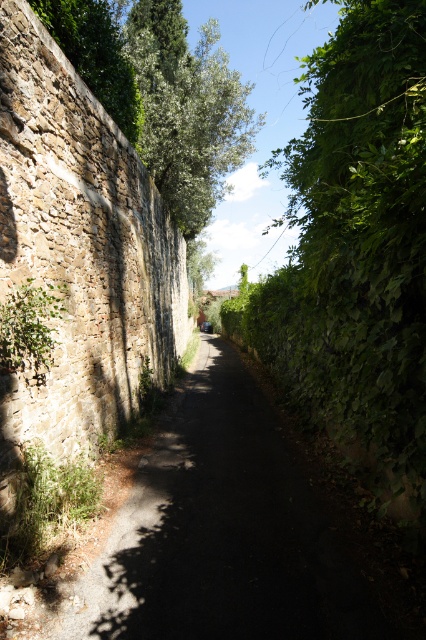
Does dark asphalt path at center appear over dark gray metallic car at center?

No, dark asphalt path at center is not above dark gray metallic car at center.

Who is lower down, dark asphalt path at center or dark gray metallic car at center?

dark asphalt path at center is lower down.

The width and height of the screenshot is (426, 640). In order to click on dark asphalt path at center in this screenshot , I will do pos(227,534).

Between dark asphalt path at center and green rough stone wall at upper left, which one is positioned lower?

dark asphalt path at center is below.

At what (x,y) coordinates should I click in order to perform the action: click on dark asphalt path at center. Please return your answer as a coordinate pair (x, y). This screenshot has height=640, width=426. Looking at the image, I should click on (227, 534).

You are a GUI agent. You are given a task and a screenshot of the screen. Output one action in this format:
    pyautogui.click(x=<x>, y=<y>)
    Task: Click on the dark asphalt path at center
    
    Given the screenshot: What is the action you would take?
    pyautogui.click(x=227, y=534)

Is green leafy hedge at right taller than green leafy tree at upper center?

Yes, green leafy hedge at right is taller than green leafy tree at upper center.

Does point (287, 166) come in front of point (173, 54)?

No, it is behind (173, 54).

What do you see at coordinates (356, 244) in the screenshot? The height and width of the screenshot is (640, 426). I see `green leafy hedge at right` at bounding box center [356, 244].

Locate an element on the screen. The height and width of the screenshot is (640, 426). green leafy hedge at right is located at coordinates (356, 244).